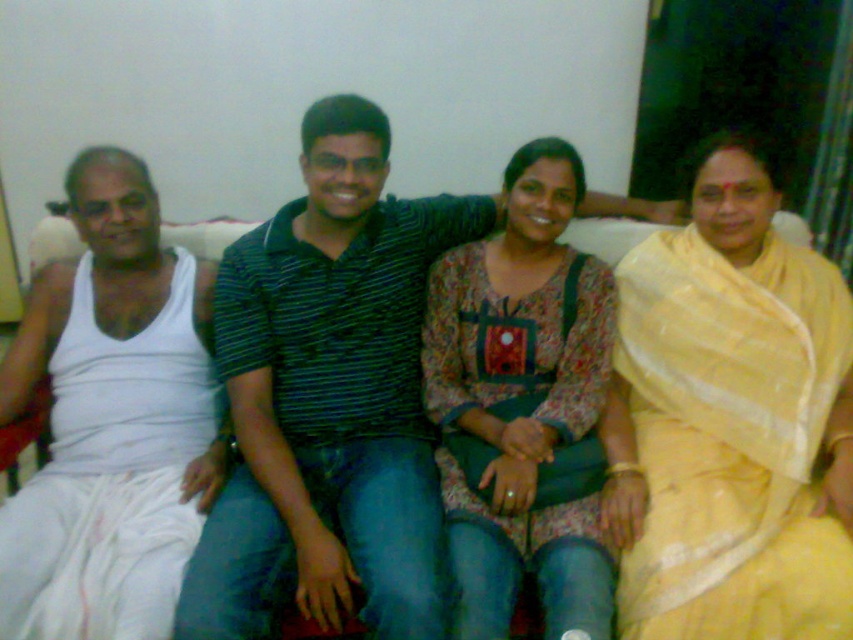
Looking at this image, in the scene where four people are sitting on a sofa, there is a point marked at coordinates (730, 420). Which object does this point correspond to?

The point at coordinates (730, 420) corresponds to the yellow silk saree at right.

Which object is the point at coordinate (111, 420) located on?

The point at coordinate (111, 420) is located on the white cotton saree at left.

You are a photographer planning to take a group photo of the yellow silk saree at right and the white cotton saree at left. Since you want to ensure both sarees are fully visible, which one should you move forward so that it doesn not get obscured?

The white cotton saree at left is behind the yellow silk saree at right. To ensure both sarees are fully visible, you should move the white cotton saree at left forward so it is no longer obscured by the yellow silk saree at right.